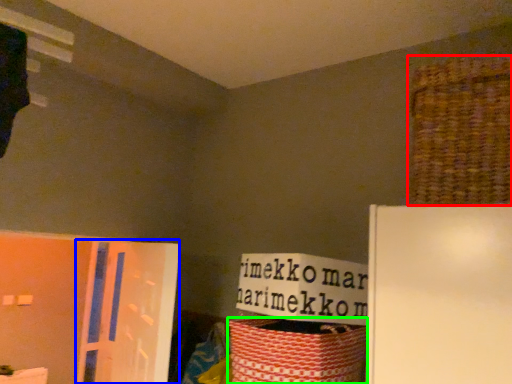
Question: Which is nearer to the basket (highlighted by a red box)? screen door (highlighted by a blue box) or basket (highlighted by a green box).

Choices:
 (A) screen door
 (B) basket

Answer: (B)